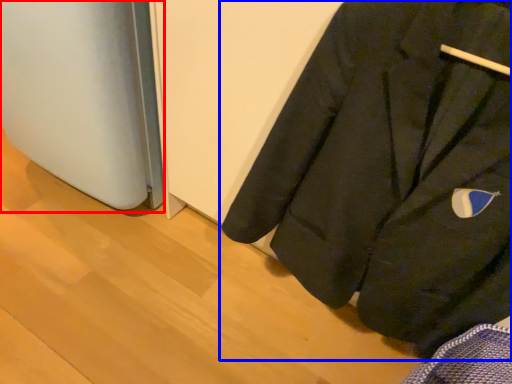
Question: Which of the following is the closest to the observer, appliance (highlighted by a red box) or coat (highlighted by a blue box)?

Choices:
 (A) appliance
 (B) coat

Answer: (B)